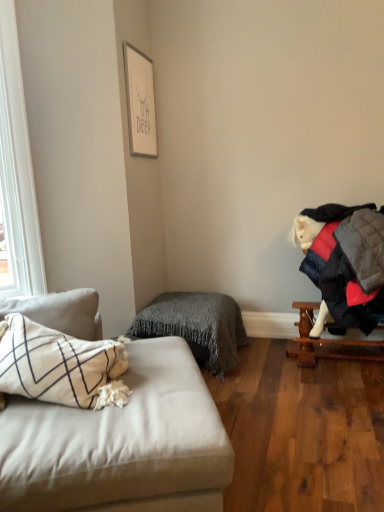
What do you see at coordinates (140, 102) in the screenshot?
I see `white matte picture frame at upper center` at bounding box center [140, 102].

In order to face light gray fabric studio couch at left, should I rotate leftwards or rightwards?

Rotate left and turn 14.162 degrees.

This screenshot has height=512, width=384. Describe the element at coordinates (120, 442) in the screenshot. I see `light gray fabric studio couch at left` at that location.

The image size is (384, 512). Describe the element at coordinates (196, 326) in the screenshot. I see `gray fuzzy blanket at center` at that location.

Identify the location of white matte picture frame at upper center. This screenshot has width=384, height=512. (140, 102).

Can you tell me how much gray fuzzy blanket at center and wooden table at right differ in facing direction?

They differ by 0.132 degrees in their facing directions.

Which is in front, gray fuzzy blanket at center or wooden table at right?

wooden table at right is in front.

From the image's perspective, which one is positioned higher, gray fuzzy blanket at center or wooden table at right?

gray fuzzy blanket at center appears higher in the image.

Considering the sizes of objects gray fuzzy blanket at center and wooden table at right in the image provided, who is smaller, gray fuzzy blanket at center or wooden table at right?

Smaller between the two is wooden table at right.

Is wooden table at right further to the viewer compared to gray fuzzy blanket at center?

No, wooden table at right is closer to the camera.

Consider the image. Is wooden table at right facing away from gray fuzzy blanket at center?

No.

From their relative heights in the image, would you say wooden table at right is taller or shorter than gray fuzzy blanket at center?

In the image, wooden table at right appears to be shorter than gray fuzzy blanket at center.

From a real-world perspective, is wooden table at right positioned over gray fuzzy blanket at center based on gravity?

No, from a real-world perspective, wooden table at right is not on top of gray fuzzy blanket at center.

From a real-world perspective, is wooden table at right over light gray fabric studio couch at left?

No, from a real-world perspective, wooden table at right is not on top of light gray fabric studio couch at left.

Is wooden table at right behind light gray fabric studio couch at left?

Yes, the depth of wooden table at right is greater than that of light gray fabric studio couch at left.

Is wooden table at right aimed at light gray fabric studio couch at left?

No, wooden table at right does not turn towards light gray fabric studio couch at left.

From the image's perspective, would you say wooden table at right is positioned over light gray fabric studio couch at left?

Correct, wooden table at right appears higher than light gray fabric studio couch at left in the image.

Considering the relative sizes of light gray fabric studio couch at left and white matte picture frame at upper center in the image provided, is light gray fabric studio couch at left shorter than white matte picture frame at upper center?

No.

Is light gray fabric studio couch at left not close to white matte picture frame at upper center?

Indeed, light gray fabric studio couch at left is not near white matte picture frame at upper center.

From the image's perspective, which one is positioned lower, light gray fabric studio couch at left or white matte picture frame at upper center?

light gray fabric studio couch at left, from the image's perspective.

Considering the relative sizes of light gray fabric studio couch at left and wooden table at right in the image provided, is light gray fabric studio couch at left shorter than wooden table at right?

No.

Is light gray fabric studio couch at left facing towards wooden table at right?

No, light gray fabric studio couch at left does not turn towards wooden table at right.

Can you confirm if light gray fabric studio couch at left is wider than wooden table at right?

Yes.

This screenshot has width=384, height=512. What are the coordinates of `studio couch below the gray fuzzy blanket at center (from the image's perspective)` in the screenshot? It's located at (120, 442).

How many degrees apart are the facing directions of gray fuzzy blanket at center and light gray fabric studio couch at left?

There is a 22.2-degree angle between the facing directions of gray fuzzy blanket at center and light gray fabric studio couch at left.

Is point (184, 310) positioned behind point (57, 412)?

That is True.

Is gray fuzzy blanket at center at the left side of light gray fabric studio couch at left?

No.

Who is shorter, white matte picture frame at upper center or light gray fabric studio couch at left?

With less height is white matte picture frame at upper center.

From a real-world perspective, is white matte picture frame at upper center on light gray fabric studio couch at left?

Indeed, from a real-world perspective, white matte picture frame at upper center stands above light gray fabric studio couch at left.

Based on the photo, from the image's perspective, would you say white matte picture frame at upper center is shown under light gray fabric studio couch at left?

No.

Which object is further away from the camera taking this photo, white matte picture frame at upper center or light gray fabric studio couch at left?

white matte picture frame at upper center is more distant.

At what (x,y) coordinates should I click in order to perform the action: click on table located underneath the gray fuzzy blanket at center (from a real-world perspective). Please return your answer as a coordinate pair (x, y). Looking at the image, I should click on (332, 342).

Where is `table below the gray fuzzy blanket at center (from the image's perspective)`? table below the gray fuzzy blanket at center (from the image's perspective) is located at coordinates (332, 342).

Estimate the real-world distances between objects in this image. Which object is closer to light gray fabric studio couch at left, gray fuzzy blanket at center or wooden table at right?

gray fuzzy blanket at center is closer to light gray fabric studio couch at left.

Considering their positions, is white matte picture frame at upper center positioned further to gray fuzzy blanket at center than light gray fabric studio couch at left?

Based on the image, white matte picture frame at upper center appears to be further to gray fuzzy blanket at center.

Based on their spatial positions, is wooden table at right or light gray fabric studio couch at left closer to gray fuzzy blanket at center?

wooden table at right is positioned closer to the anchor gray fuzzy blanket at center.

Based on their spatial positions, is light gray fabric studio couch at left or white matte picture frame at upper center closer to wooden table at right?

The object closer to wooden table at right is light gray fabric studio couch at left.

From the image, which object appears to be farther from light gray fabric studio couch at left, wooden table at right or white matte picture frame at upper center?

Based on the image, white matte picture frame at upper center appears to be further to light gray fabric studio couch at left.

Based on their spatial positions, is wooden table at right or gray fuzzy blanket at center further from light gray fabric studio couch at left?

wooden table at right lies further to light gray fabric studio couch at left than the other object.

From the picture: Estimate the real-world distances between objects in this image. Which object is further from light gray fabric studio couch at left, gray fuzzy blanket at center or white matte picture frame at upper center?

white matte picture frame at upper center lies further to light gray fabric studio couch at left than the other object.

Based on their spatial positions, is gray fuzzy blanket at center or white matte picture frame at upper center closer to wooden table at right?

gray fuzzy blanket at center lies closer to wooden table at right than the other object.

Locate an element on the screen. bedding between white matte picture frame at upper center and wooden table at right in the vertical direction is located at coordinates (196, 326).

In order to click on table that lies between white matte picture frame at upper center and light gray fabric studio couch at left from top to bottom in this screenshot , I will do `click(332, 342)`.

I want to click on bedding between white matte picture frame at upper center and light gray fabric studio couch at left from top to bottom, so click(x=196, y=326).

You are a GUI agent. You are given a task and a screenshot of the screen. Output one action in this format:
    pyautogui.click(x=<x>, y=<y>)
    Task: Click on the table positioned between light gray fabric studio couch at left and gray fuzzy blanket at center from near to far
    The width and height of the screenshot is (384, 512).
    Given the screenshot: What is the action you would take?
    pyautogui.click(x=332, y=342)